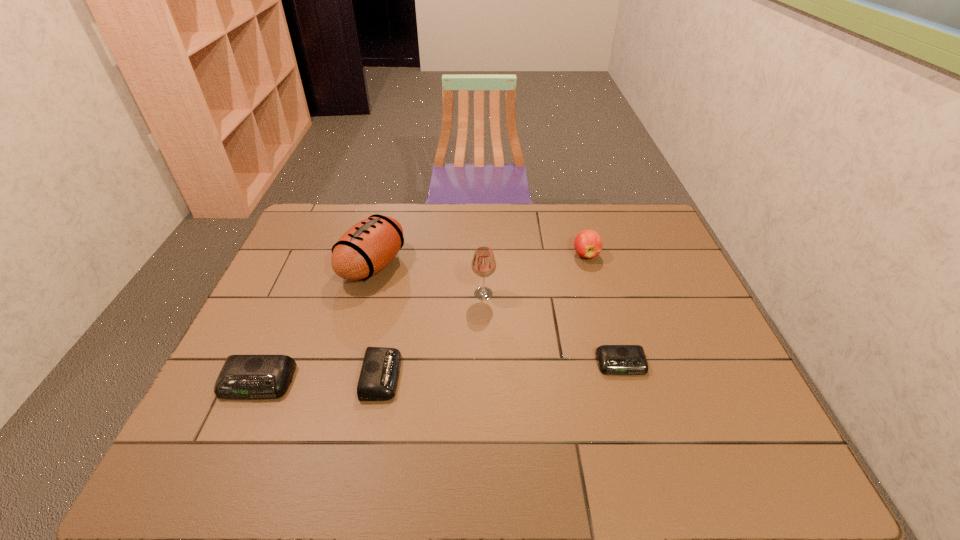
Where is `vacant space that satisfies the following two spatial constraints: 1. on the display of the fifth tallest object; 2. on the display of the leftmost object`? vacant space that satisfies the following two spatial constraints: 1. on the display of the fifth tallest object; 2. on the display of the leftmost object is located at coordinates (380, 382).